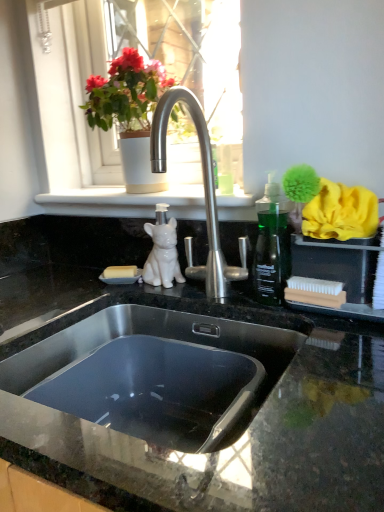
Question: Considering the positions of white ceramic pot at upper center and black granite countertop at center in the image, is white ceramic pot at upper center bigger or smaller than black granite countertop at center?

Choices:
 (A) small
 (B) big

Answer: (A)

Question: Considering their positions, is white ceramic pot at upper center located in front of or behind black granite countertop at center?

Choices:
 (A) front
 (B) behind

Answer: (B)

Question: Estimate the real-world distances between objects in this image. Which object is closer to the matte white pot at upper center?

Choices:
 (A) black granite countertop at center
 (B) stainless steel sink at center
 (C) white glossy dog at center
 (D) white ceramic pot at upper center

Answer: (D)

Question: Which of these objects is positioned farthest from the white glossy dog at center?

Choices:
 (A) white ceramic pot at upper center
 (B) matte white pot at upper center
 (C) stainless steel sink at center
 (D) black granite countertop at center

Answer: (A)